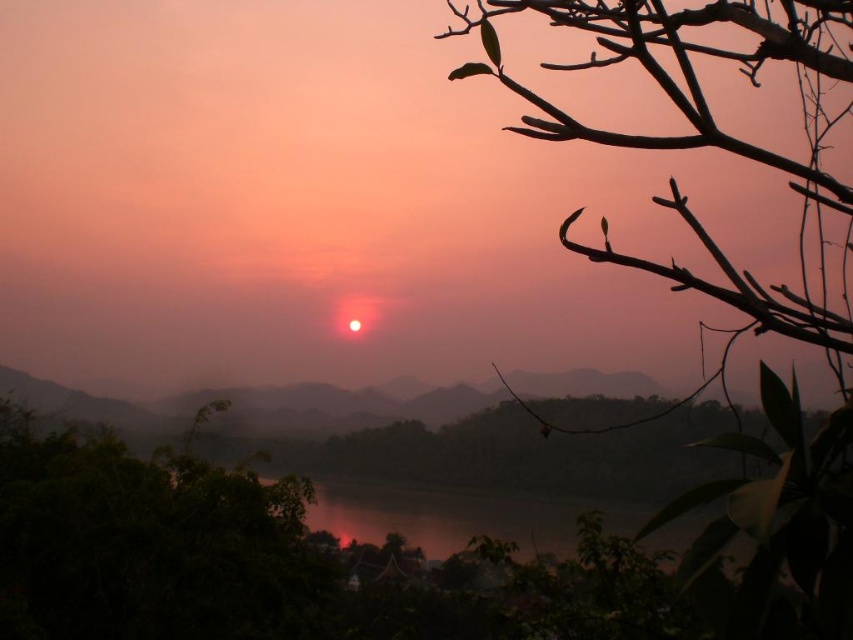
Question: Which point is farther to the camera?

Choices:
 (A) dark reflective water at center
 (B) silhouette branch at upper right

Answer: (A)

Question: Is silhouette branch at upper right thinner than dark reflective water at center?

Choices:
 (A) no
 (B) yes

Answer: (B)

Question: Does silhouette branch at upper right appear over dark reflective water at center?

Choices:
 (A) yes
 (B) no

Answer: (A)

Question: Where is silhouette branch at upper right located in relation to dark reflective water at center in the image?

Choices:
 (A) right
 (B) left

Answer: (A)

Question: Which point is farther from the camera taking this photo?

Choices:
 (A) (758, 499)
 (B) (370, 513)

Answer: (B)